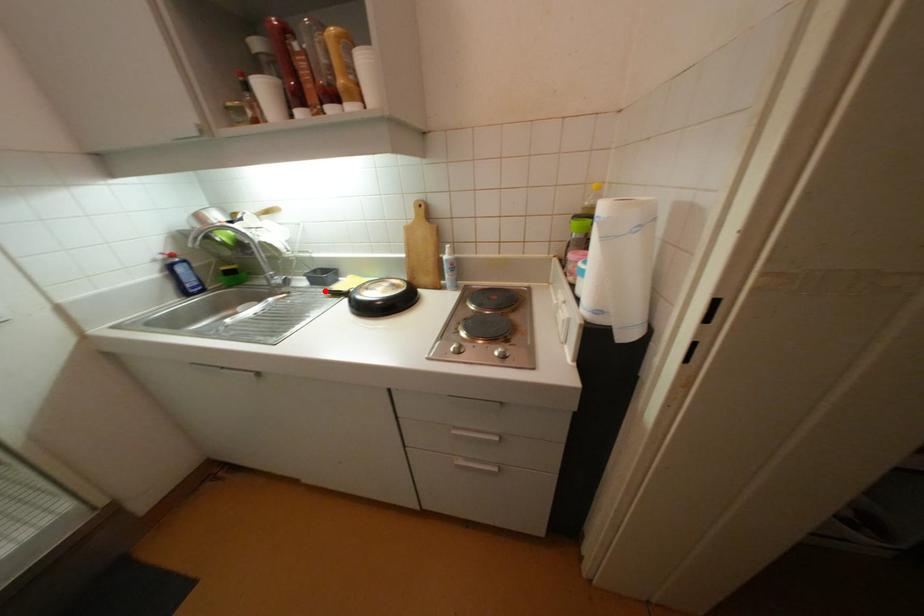
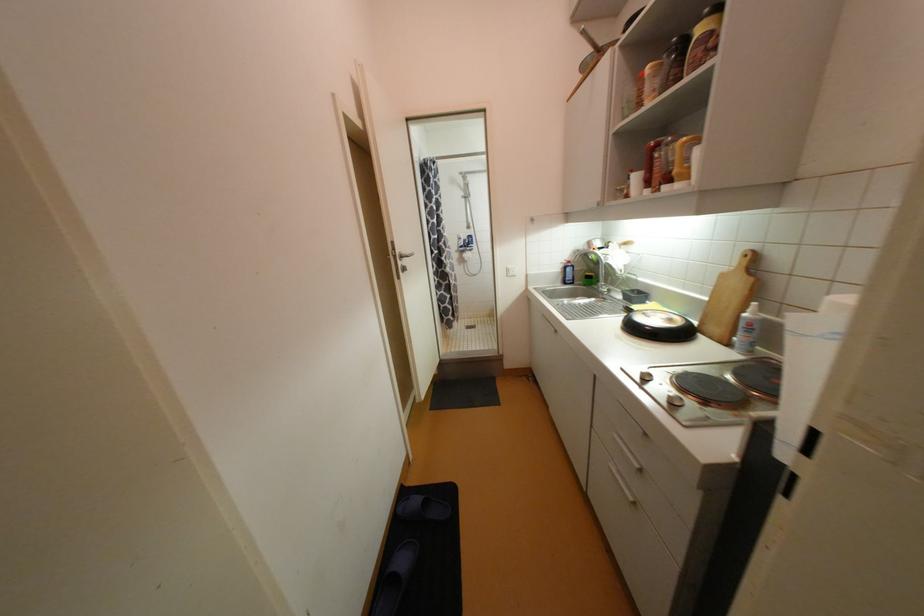
In the second image, find the point that corresponds to the highlighted location in the first image.

(628, 305)